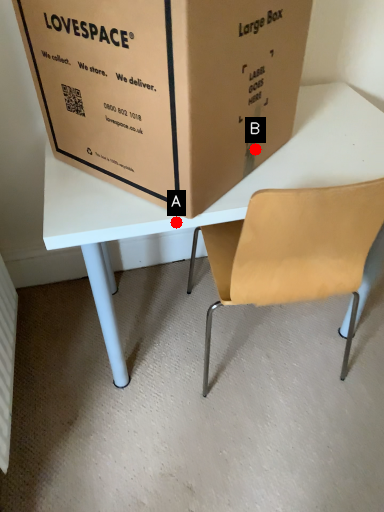
Question: Two points are circled on the image, labeled by A and B beside each circle. Which point is closer to the camera taking this photo?

Choices:
 (A) A is closer
 (B) B is closer

Answer: (A)